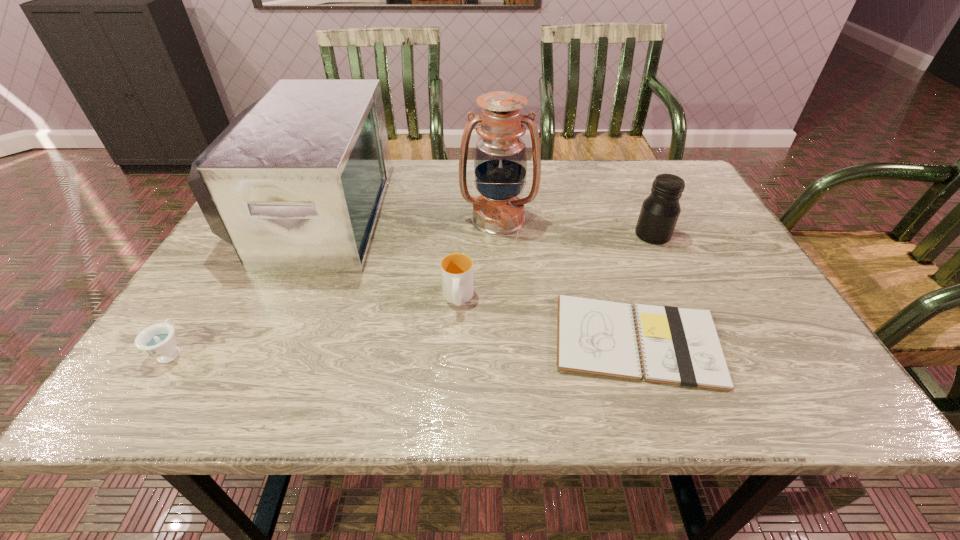
This screenshot has height=540, width=960. Find the location of `vacant space located on the side of the teacup with the handle`. vacant space located on the side of the teacup with the handle is located at coordinates (258, 215).

Where is `free space located on the side of the teacup with the handle`? This screenshot has height=540, width=960. free space located on the side of the teacup with the handle is located at coordinates (255, 220).

Locate an element on the screen. free spot located 0.260m on the side of the teacup with the handle is located at coordinates (236, 249).

In order to click on free space located on the back of the notepad in this screenshot , I will do `click(603, 238)`.

Locate an element on the screen. This screenshot has width=960, height=540. oil lamp that is positioned at the far edge is located at coordinates (500, 161).

The width and height of the screenshot is (960, 540). Find the location of `microwave oven at the far edge`. microwave oven at the far edge is located at coordinates (295, 183).

This screenshot has width=960, height=540. Identify the location of teacup that is at the near edge. (158, 340).

Identify the location of notepad that is at the near edge. (678, 346).

You are a GUI agent. You are given a task and a screenshot of the screen. Output one action in this format:
    pyautogui.click(x=<x>, y=<y>)
    Task: Click on the microwave oven at the left edge
    The width and height of the screenshot is (960, 540).
    Given the screenshot: What is the action you would take?
    pyautogui.click(x=295, y=183)

The image size is (960, 540). Find the location of `teacup located in the left edge section of the desktop`. teacup located in the left edge section of the desktop is located at coordinates (158, 340).